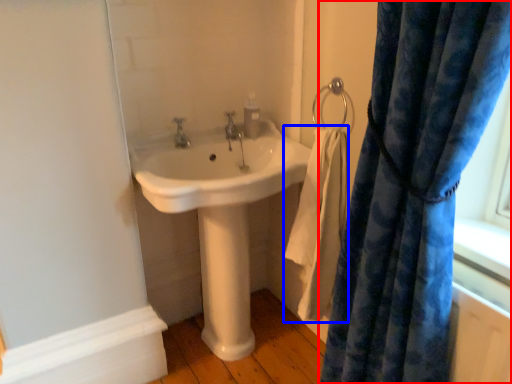
Question: Among these objects, which one is nearest to the camera, curtain (highlighted by a red box) or bath towel (highlighted by a blue box)?

Choices:
 (A) curtain
 (B) bath towel

Answer: (A)